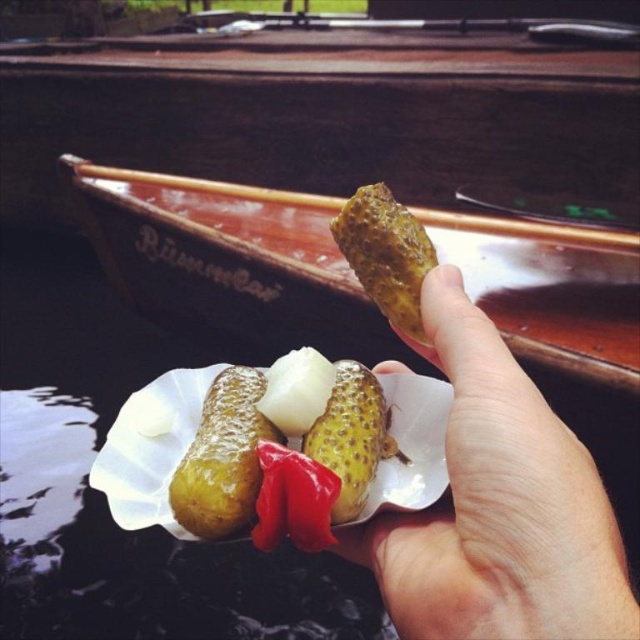
You are a chef preparing a dish and need to place the yellow speckled pickle at center on the smooth skin hand at center. Can you fit the pickle on the hand without it falling off?

The smooth skin hand at center is taller than yellow speckled pickle at center, so yes, the pickle can be placed on the hand without falling off as the hand is larger in height.

You are on a wooden boat and want to drop food into the water. You have a plate with pickled gherkins, a white onion slice, and a red pepper piece. You see two points in the water labeled as point [516,493] and point [362,502]. Which point should you aim for if you want the food to land closer to the front of the boat?

You should aim for point [516,493] because it is in front of point [362,502] according to the description.

You are a food critic evaluating the presentation of this dish. The shiny golden pickle at center and the translucent white pickles at center are key elements. Which of these two items is wider?

The shiny golden pickle at center is wider than the translucent white pickles at center, as its width surpasses the latter.